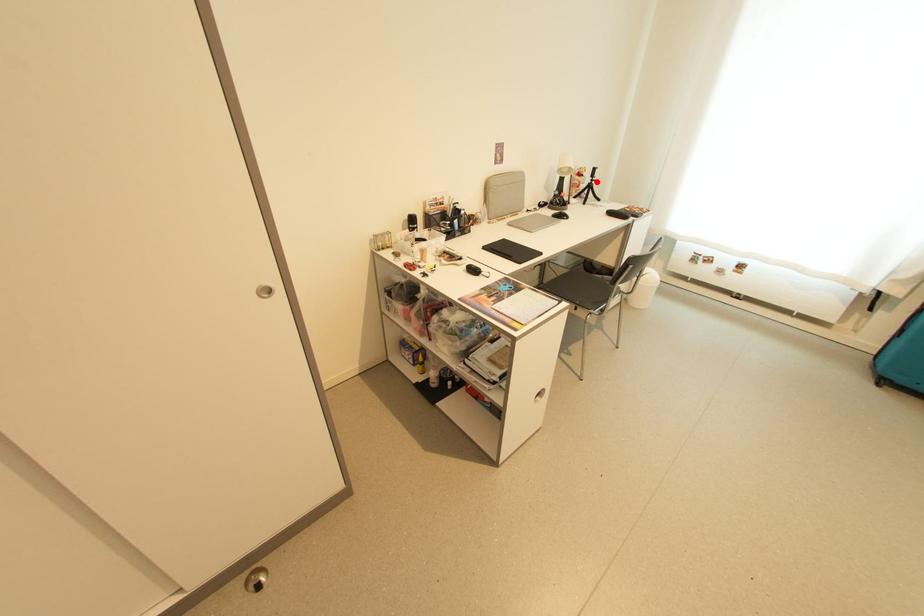
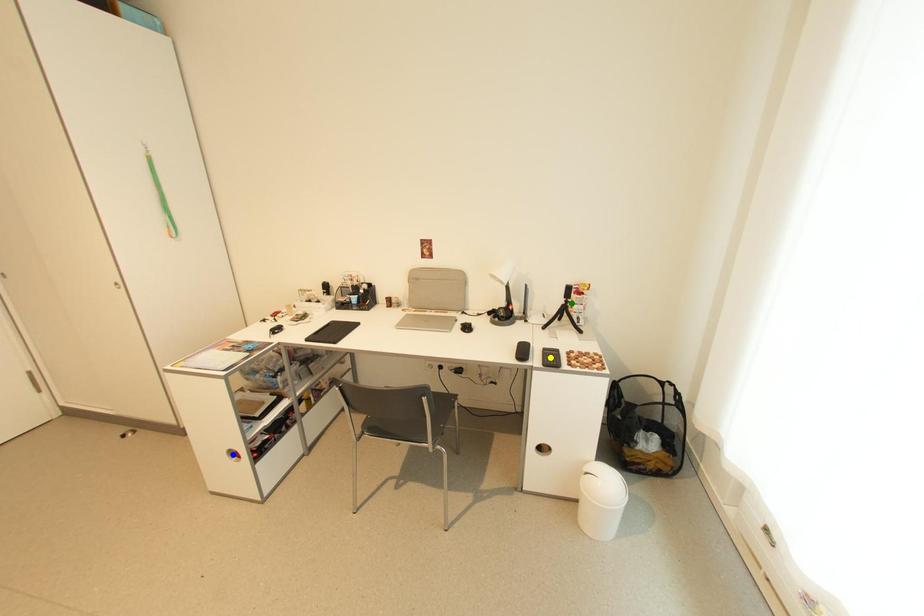
Question: I am providing you with two images of the same scene from different viewpoints. A red point is marked on the first image. You are given multiple points on the second image. In image 2, which mark is for the same physical point as the one in image 1?

Choices:
 (A) blue point
 (B) green point
 (C) yellow point

Answer: (B)